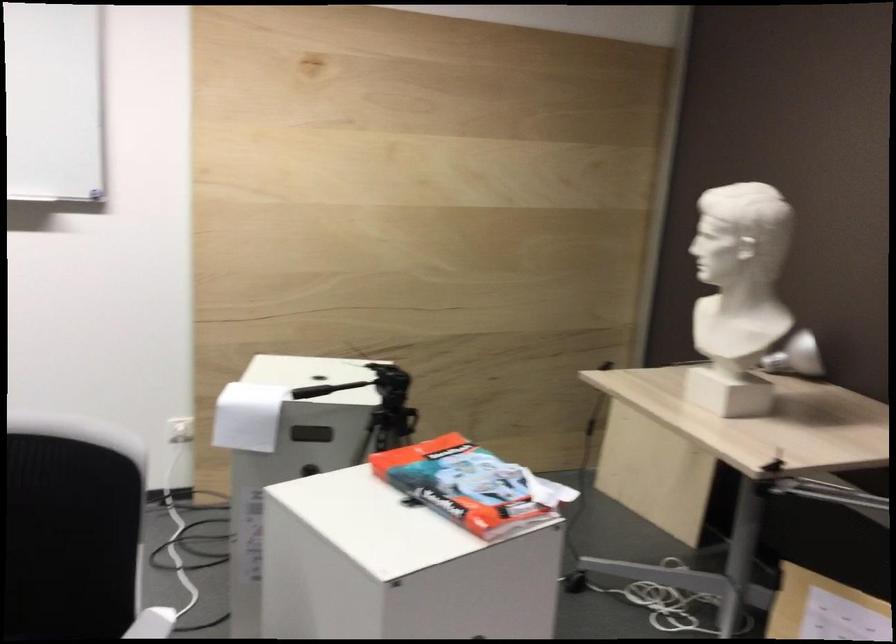
Describe the element at coordinates (179, 430) in the screenshot. Image resolution: width=896 pixels, height=644 pixels. I see `the white electrical plug` at that location.